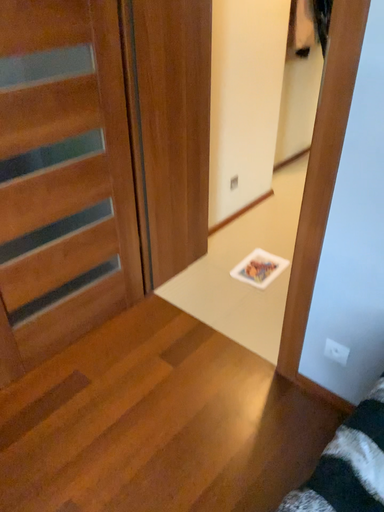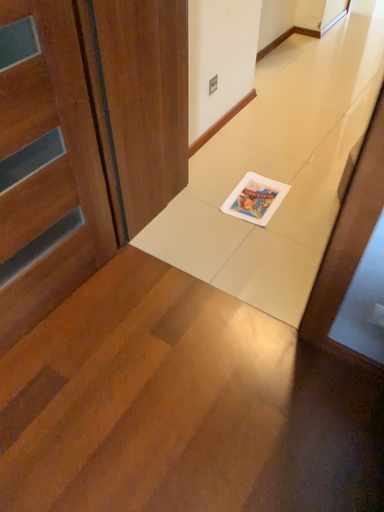
Question: How did the camera likely rotate when shooting the video?

Choices:
 (A) rotated upward
 (B) rotated downward

Answer: (B)